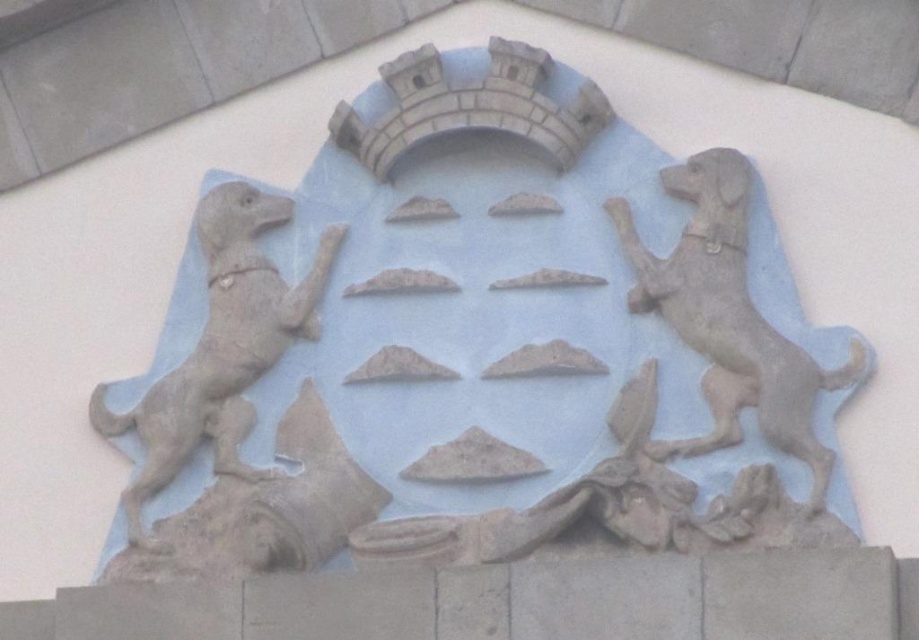
Question: Where is stone dogs at center located in relation to gray stone dog at right in the image?

Choices:
 (A) below
 (B) above

Answer: (A)

Question: Is stone dogs at center wider than gray stone dog at right?

Choices:
 (A) yes
 (B) no

Answer: (A)

Question: Estimate the real-world distances between objects in this image. Which object is farther from the stone dogs at center?

Choices:
 (A) gray stone dog at right
 (B) gray stone dog at left

Answer: (A)

Question: Estimate the real-world distances between objects in this image. Which object is farther from the stone dogs at center?

Choices:
 (A) gray stone dog at left
 (B) gray stone dog at right

Answer: (B)

Question: Observing the image, what is the correct spatial positioning of stone dogs at center in reference to gray stone dog at left?

Choices:
 (A) above
 (B) below

Answer: (A)

Question: Which object is the farthest from the gray stone dog at left?

Choices:
 (A) gray stone dog at right
 (B) stone dogs at center

Answer: (A)